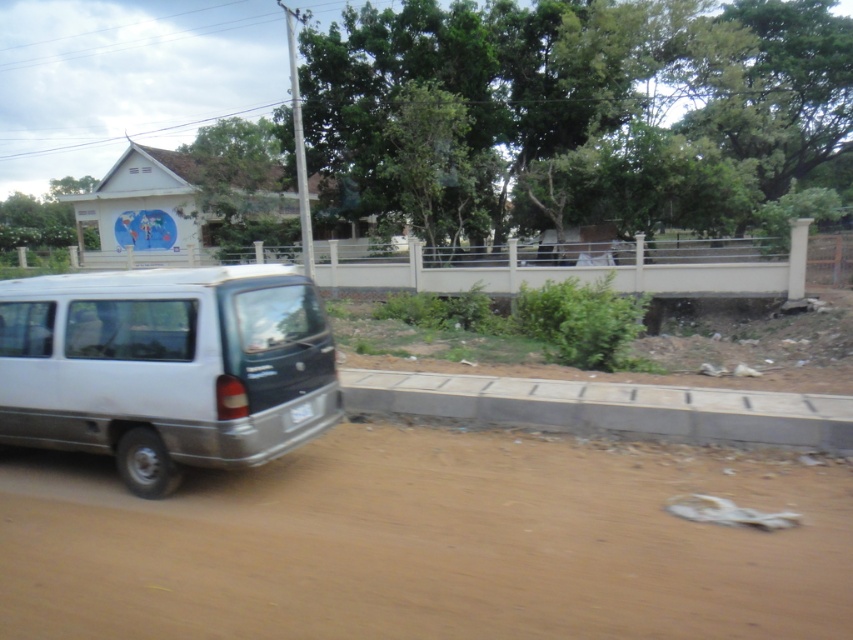
You are driving a car that is 6 feet wide. You need to cross the road between the brown dirt track at lower left and the gray concrete curb at lower center. Can your car fit through the space between them?

The distance between the brown dirt track at lower left and the gray concrete curb at lower center is 8.30 feet, which is wider than your car width of 6 feet. Therefore, your car can fit through the space between them.

You are a driver approaching the white matte minivan at lower left on the brown dirt track at lower left. Which side of the minivan should you stay on to follow the correct driving direction?

The brown dirt track at lower left is positioned on the right side of the white matte minivan at lower left, so you should stay on the right side of the minivan to follow the correct driving direction.